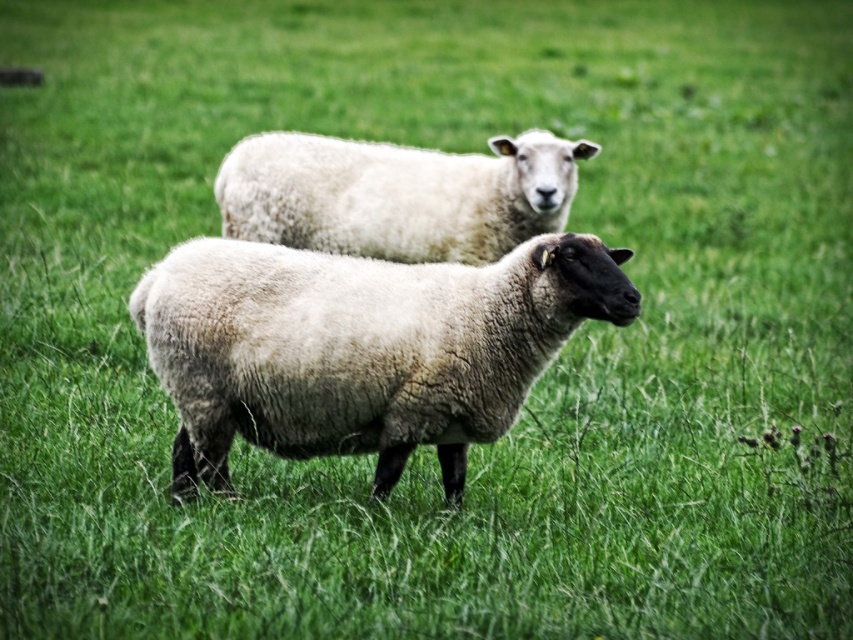
Question: Can you confirm if white woolen sheep at center is wider than white woolly sheep at upper center?

Choices:
 (A) no
 (B) yes

Answer: (A)

Question: Which point is farther to the camera?

Choices:
 (A) [x=439, y=445]
 (B) [x=345, y=182]

Answer: (B)

Question: Which point is closer to the camera?

Choices:
 (A) (311, 304)
 (B) (468, 202)

Answer: (A)

Question: Which point is farther to the camera?

Choices:
 (A) (303, 392)
 (B) (259, 188)

Answer: (B)

Question: Is white woolen sheep at center thinner than white woolly sheep at upper center?

Choices:
 (A) no
 (B) yes

Answer: (B)

Question: Is white woolen sheep at center closer to camera compared to white woolly sheep at upper center?

Choices:
 (A) yes
 (B) no

Answer: (A)